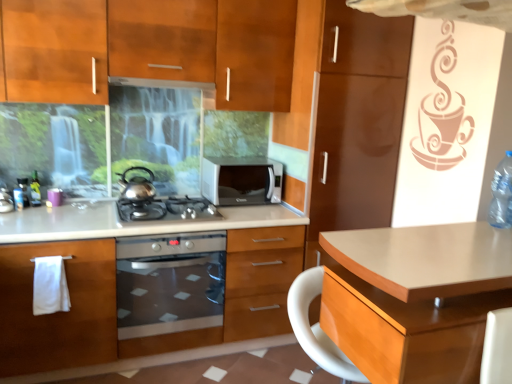
Question: From a real-world perspective, is matte wood desk at center below satin silver gas stove at center?

Choices:
 (A) no
 (B) yes

Answer: (B)

Question: Could you tell me if matte wood desk at center is turned towards satin silver gas stove at center?

Choices:
 (A) yes
 (B) no

Answer: (B)

Question: Is matte wood desk at center at the left side of satin silver gas stove at center?

Choices:
 (A) no
 (B) yes

Answer: (A)

Question: From a real-world perspective, does matte wood desk at center stand above satin silver gas stove at center?

Choices:
 (A) yes
 (B) no

Answer: (B)

Question: From the image's perspective, would you say matte wood desk at center is positioned over satin silver gas stove at center?

Choices:
 (A) yes
 (B) no

Answer: (B)

Question: Considering the relative positions of matte wood oven at center, marked as the first cabinetry in a bottom-to-top arrangement, and matte wood desk at center in the image provided, is matte wood oven at center, marked as the first cabinetry in a bottom-to-top arrangement, to the left or to the right of matte wood desk at center?

Choices:
 (A) right
 (B) left

Answer: (B)

Question: Does point (61, 317) appear closer or farther from the camera than point (404, 355)?

Choices:
 (A) farther
 (B) closer

Answer: (A)

Question: Is matte wood oven at center, marked as the first cabinetry in a bottom-to-top arrangement, taller or shorter than matte wood desk at center?

Choices:
 (A) tall
 (B) short

Answer: (B)

Question: Considering the positions of matte wood oven at center, marked as the first cabinetry in a bottom-to-top arrangement, and matte wood desk at center in the image, is matte wood oven at center, marked as the first cabinetry in a bottom-to-top arrangement, wider or thinner than matte wood desk at center?

Choices:
 (A) wide
 (B) thin

Answer: (A)

Question: In terms of height, does matte stainless steel exhaust hood at upper center look taller or shorter compared to satin silver gas stove at center?

Choices:
 (A) tall
 (B) short

Answer: (B)

Question: Would you say matte stainless steel exhaust hood at upper center is to the left or to the right of satin silver gas stove at center in the picture?

Choices:
 (A) right
 (B) left

Answer: (B)

Question: Is matte stainless steel exhaust hood at upper center in front of or behind satin silver gas stove at center in the image?

Choices:
 (A) behind
 (B) front

Answer: (A)

Question: Is matte stainless steel exhaust hood at upper center bigger or smaller than satin silver gas stove at center?

Choices:
 (A) small
 (B) big

Answer: (A)

Question: Would you say satin silver gas stove at center is to the left or to the right of matte wood cabinets at upper center, which appears as the first cabinetry when viewed from the top, in the picture?

Choices:
 (A) right
 (B) left

Answer: (A)

Question: Looking at the image, does satin silver gas stove at center seem bigger or smaller compared to matte wood cabinets at upper center, which appears as the first cabinetry when viewed from the top?

Choices:
 (A) big
 (B) small

Answer: (B)